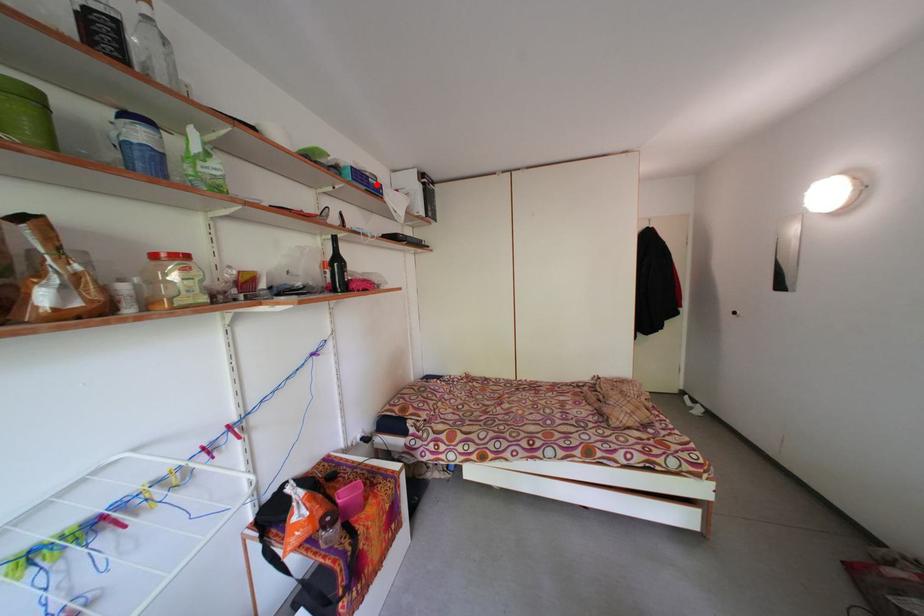
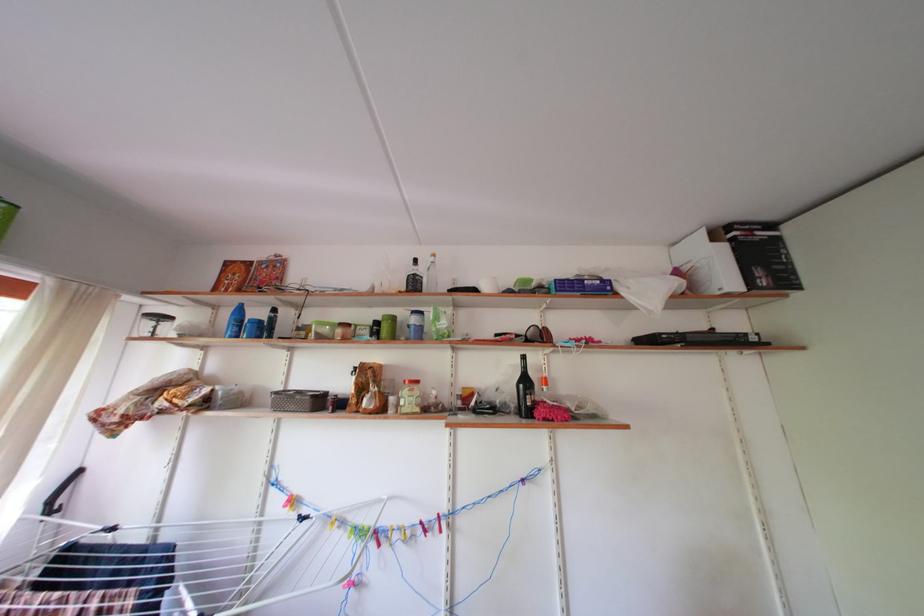
Find the pixel in the second image that matches the highlighted location in the first image.

(591, 286)